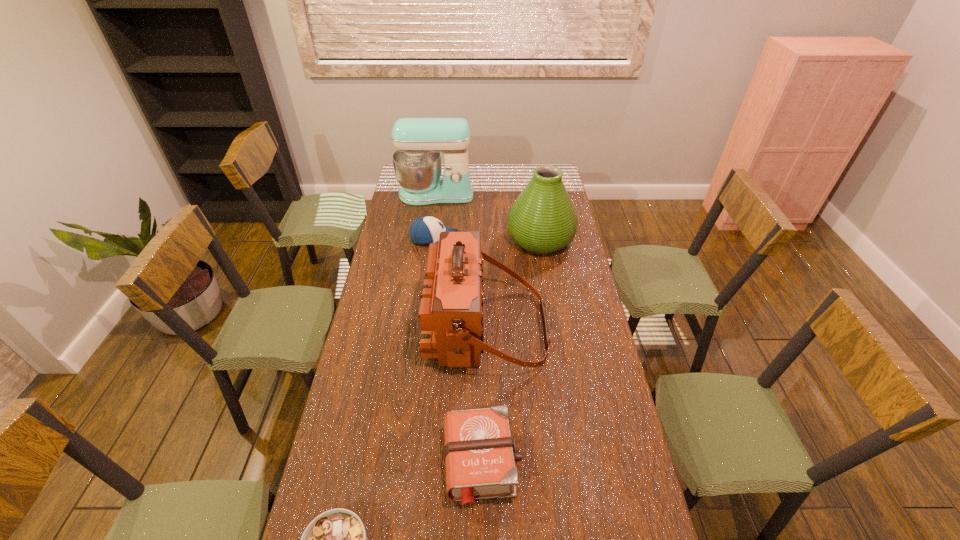
At what (x,y) coordinates should I click in order to perform the action: click on blank space located on the front-facing side of the baseball cap. Please return your answer as a coordinate pair (x, y). The image size is (960, 540). Looking at the image, I should click on (478, 239).

Image resolution: width=960 pixels, height=540 pixels. Find the location of `vacant region located 0.120m on the right of the second nearest object`. vacant region located 0.120m on the right of the second nearest object is located at coordinates (564, 462).

The image size is (960, 540). Identify the location of object that is at the far edge. (419, 142).

At what (x,y) coordinates should I click in order to perform the action: click on mixer that is at the left edge. Please return your answer as a coordinate pair (x, y). The height and width of the screenshot is (540, 960). Looking at the image, I should click on (419, 142).

This screenshot has height=540, width=960. What are the coordinates of `baseball cap that is at the left edge` in the screenshot? It's located at (425, 230).

I want to click on object positioned at the right edge, so click(542, 220).

Locate an element on the screen. Image resolution: width=960 pixels, height=540 pixels. object that is at the far left corner is located at coordinates (419, 142).

Where is `vacant space at the left edge of the desktop`? The width and height of the screenshot is (960, 540). vacant space at the left edge of the desktop is located at coordinates (394, 363).

Image resolution: width=960 pixels, height=540 pixels. I want to click on blank space at the right edge of the desktop, so click(x=577, y=287).

Find the location of a particular element. unoccupied position between the fourth tallest object and the vase is located at coordinates (488, 239).